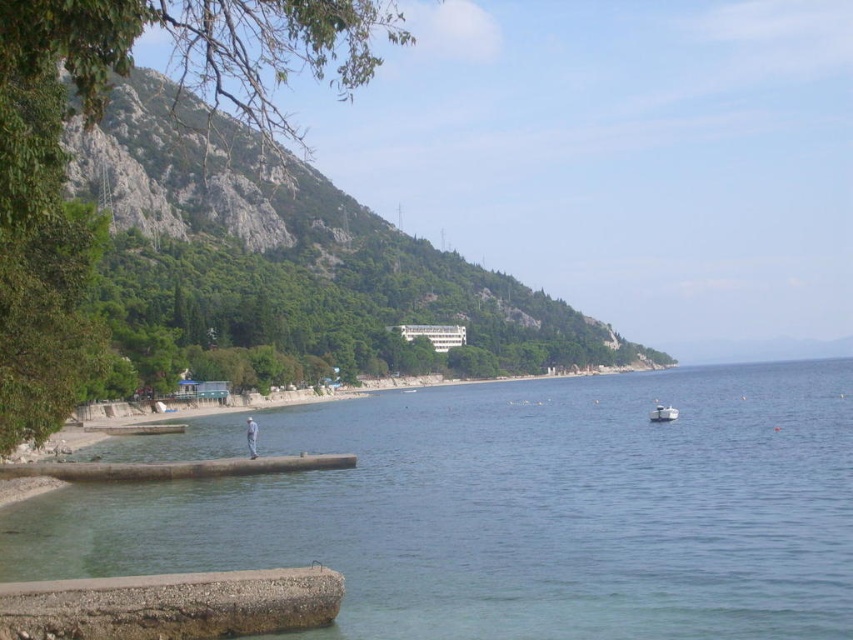
You are a bird flying over the coastal scene. You see the green leafy hillside at upper left and the white plastic boat at lower right. Which object is closer to you from your aerial viewpoint?

The green leafy hillside at upper left is closer to you because the white plastic boat at lower right is positioned behind it from your aerial viewpoint.